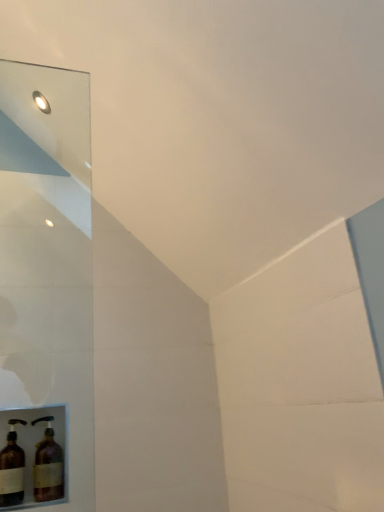
Question: From the image's perspective, is brown glass bottle at lower left, which appears as the 2th bottle when viewed from the left, above brown glass bottle at lower left, arranged as the 2th bottle when viewed from the right?

Choices:
 (A) no
 (B) yes

Answer: (A)

Question: Considering the relative sizes of brown glass bottle at lower left, which appears as the 2th bottle when viewed from the left, and brown glass bottle at lower left, marked as the 1th bottle in a left-to-right arrangement, in the image provided, is brown glass bottle at lower left, which appears as the 2th bottle when viewed from the left, wider than brown glass bottle at lower left, marked as the 1th bottle in a left-to-right arrangement,?

Choices:
 (A) yes
 (B) no

Answer: (A)

Question: Considering the relative sizes of brown glass bottle at lower left, which appears as the 2th bottle when viewed from the left, and brown glass bottle at lower left, marked as the 1th bottle in a left-to-right arrangement, in the image provided, is brown glass bottle at lower left, which appears as the 2th bottle when viewed from the left, shorter than brown glass bottle at lower left, marked as the 1th bottle in a left-to-right arrangement,?

Choices:
 (A) no
 (B) yes

Answer: (B)

Question: From a real-world perspective, is brown glass bottle at lower left, which ranks as the 1th bottle in right-to-left order, on brown glass bottle at lower left, marked as the 1th bottle in a left-to-right arrangement?

Choices:
 (A) yes
 (B) no

Answer: (A)

Question: Does brown glass bottle at lower left, which appears as the 2th bottle when viewed from the left, lie in front of brown glass bottle at lower left, marked as the 1th bottle in a left-to-right arrangement?

Choices:
 (A) yes
 (B) no

Answer: (B)

Question: Considering the relative sizes of brown glass bottle at lower left, which ranks as the 1th bottle in right-to-left order, and brown glass bottle at lower left, arranged as the 2th bottle when viewed from the right, in the image provided, is brown glass bottle at lower left, which ranks as the 1th bottle in right-to-left order, taller than brown glass bottle at lower left, arranged as the 2th bottle when viewed from the right,?

Choices:
 (A) yes
 (B) no

Answer: (B)

Question: Does brown glass bottle at lower left, marked as the 1th bottle in a left-to-right arrangement, appear on the left side of brown glass bottle at lower left, which appears as the 2th bottle when viewed from the left?

Choices:
 (A) yes
 (B) no

Answer: (A)

Question: Does brown glass bottle at lower left, marked as the 1th bottle in a left-to-right arrangement, have a greater width compared to brown glass bottle at lower left, which ranks as the 1th bottle in right-to-left order?

Choices:
 (A) yes
 (B) no

Answer: (B)

Question: Is brown glass bottle at lower left, arranged as the 2th bottle when viewed from the right, not close to brown glass bottle at lower left, which ranks as the 1th bottle in right-to-left order?

Choices:
 (A) yes
 (B) no

Answer: (B)

Question: Could you tell me if brown glass bottle at lower left, marked as the 1th bottle in a left-to-right arrangement, is facing brown glass bottle at lower left, which appears as the 2th bottle when viewed from the left?

Choices:
 (A) no
 (B) yes

Answer: (A)

Question: Is brown glass bottle at lower left, marked as the 1th bottle in a left-to-right arrangement, directly adjacent to brown glass bottle at lower left, which ranks as the 1th bottle in right-to-left order?

Choices:
 (A) no
 (B) yes

Answer: (B)

Question: Does brown glass bottle at lower left, arranged as the 2th bottle when viewed from the right, lie in front of brown glass bottle at lower left, which ranks as the 1th bottle in right-to-left order?

Choices:
 (A) no
 (B) yes

Answer: (B)

Question: Looking at the image, does brown glass bottle at lower left, which ranks as the 1th bottle in right-to-left order, seem bigger or smaller compared to brown glass bottle at lower left, marked as the 1th bottle in a left-to-right arrangement?

Choices:
 (A) big
 (B) small

Answer: (A)